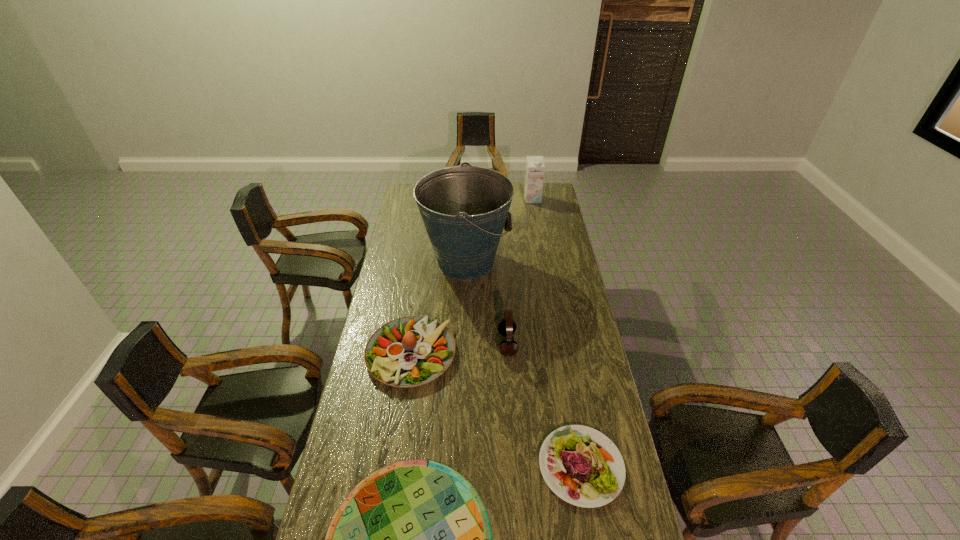
The height and width of the screenshot is (540, 960). Identify the location of object that is at the far right corner. (534, 177).

In the image, there is a desktop. Find the location of `vacant space at the right edge`. vacant space at the right edge is located at coordinates (559, 308).

Where is `free space between the headset and the tallest object`? free space between the headset and the tallest object is located at coordinates (487, 303).

Image resolution: width=960 pixels, height=540 pixels. I want to click on free spot between the right salad plate and the carton, so click(557, 333).

At what (x,y) coordinates should I click in order to perform the action: click on empty space that is in between the left salad plate and the headset. Please return your answer as a coordinate pair (x, y). The height and width of the screenshot is (540, 960). Looking at the image, I should click on [x=459, y=349].

Identify the location of vacant area that lies between the bucket and the taller salad plate. (439, 308).

At what (x,y) coordinates should I click in order to perform the action: click on free space between the left salad plate and the second shortest object. Please return your answer as a coordinate pair (x, y). The width and height of the screenshot is (960, 540). Looking at the image, I should click on (496, 410).

Image resolution: width=960 pixels, height=540 pixels. In order to click on the fourth closest object to the right salad plate in this screenshot , I will do `click(464, 209)`.

The image size is (960, 540). Identify the location of the fourth closest object to the fifth tallest object. (464, 209).